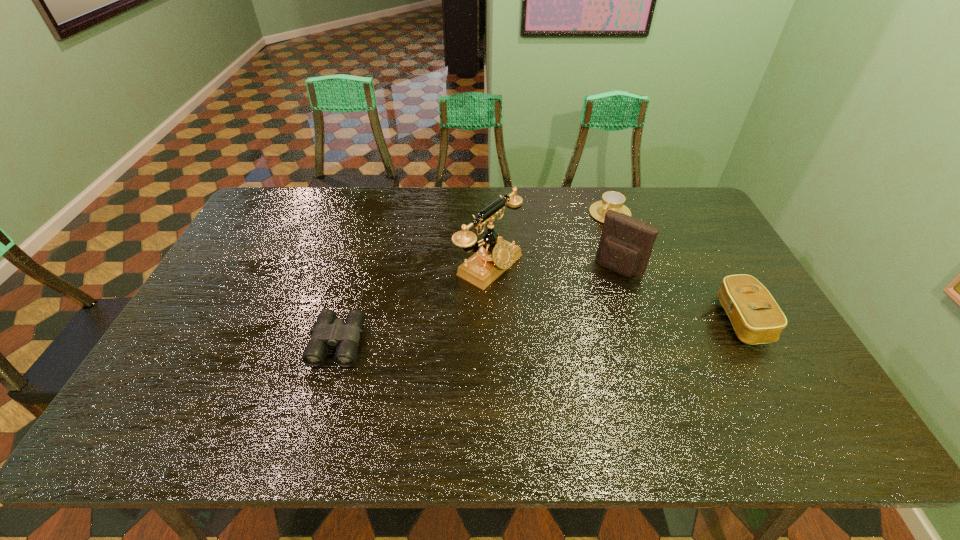
The height and width of the screenshot is (540, 960). I want to click on vacant area at the far edge, so click(423, 221).

Identify the location of free space at the left edge of the desktop. The height and width of the screenshot is (540, 960). (255, 237).

This screenshot has width=960, height=540. In the image, there is a desktop. In order to click on vacant space at the right edge in this screenshot , I will do `click(724, 320)`.

This screenshot has height=540, width=960. In the image, there is a desktop. Identify the location of vacant space at the far left corner. (272, 222).

Where is `free spot between the tallest object and the second tallest object`? The height and width of the screenshot is (540, 960). free spot between the tallest object and the second tallest object is located at coordinates (554, 267).

The width and height of the screenshot is (960, 540). I want to click on blank region between the rightmost object and the leftmost object, so click(x=541, y=321).

Where is `vacant area between the clutch bag and the telephone`? vacant area between the clutch bag and the telephone is located at coordinates (615, 293).

Identify the location of free spot between the rightmost object and the second tallest object. (680, 294).

The height and width of the screenshot is (540, 960). I want to click on free space between the farthest object and the rightmost object, so click(676, 266).

Where is `empty location between the farthest object and the tallest object`? empty location between the farthest object and the tallest object is located at coordinates tap(550, 240).